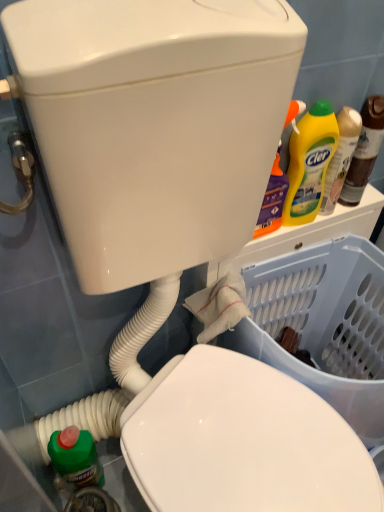
Question: Is transparent plastic basket at lower right outside yellow matte bottle at upper right?

Choices:
 (A) yes
 (B) no

Answer: (A)

Question: Is transparent plastic basket at lower right in front of yellow matte bottle at upper right?

Choices:
 (A) no
 (B) yes

Answer: (B)

Question: Does transparent plastic basket at lower right have a lesser width compared to yellow matte bottle at upper right?

Choices:
 (A) yes
 (B) no

Answer: (B)

Question: Is there a large distance between transparent plastic basket at lower right and yellow matte bottle at upper right?

Choices:
 (A) no
 (B) yes

Answer: (A)

Question: From the image's perspective, is transparent plastic basket at lower right under yellow matte bottle at upper right?

Choices:
 (A) yes
 (B) no

Answer: (A)

Question: Can you confirm if transparent plastic basket at lower right is shorter than yellow matte bottle at upper right?

Choices:
 (A) no
 (B) yes

Answer: (A)

Question: Does yellow matte bottle at upper right have a greater height compared to yellow liquid detergent at upper right, which is the second bottle from left to right?

Choices:
 (A) yes
 (B) no

Answer: (A)

Question: From the image's perspective, is yellow matte bottle at upper right located beneath yellow liquid detergent at upper right, which is the second bottle from left to right?

Choices:
 (A) no
 (B) yes

Answer: (B)

Question: From the image's perspective, is yellow matte bottle at upper right over yellow liquid detergent at upper right, which is the second bottle from left to right?

Choices:
 (A) yes
 (B) no

Answer: (B)

Question: From a real-world perspective, is yellow matte bottle at upper right physically above yellow liquid detergent at upper right, which is the second bottle from left to right?

Choices:
 (A) yes
 (B) no

Answer: (A)

Question: From a real-world perspective, is yellow matte bottle at upper right positioned under yellow liquid detergent at upper right, which is the 1th bottle from right to left, based on gravity?

Choices:
 (A) yes
 (B) no

Answer: (B)

Question: Is yellow matte bottle at upper right to the left of yellow liquid detergent at upper right, which is the 1th bottle from right to left, from the viewer's perspective?

Choices:
 (A) no
 (B) yes

Answer: (B)

Question: Are yellow matte bottle at upper right and yellow plastic bottle at upper right, the 1th bottle when ordered from left to right, far apart?

Choices:
 (A) no
 (B) yes

Answer: (A)